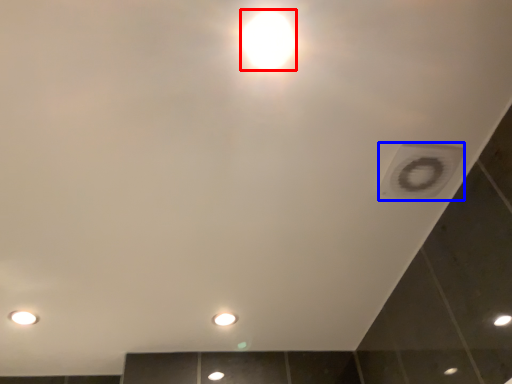
Question: Which point is closer to the camera, light bulb (highlighted by a red box) or hole (highlighted by a blue box)?

Choices:
 (A) light bulb
 (B) hole

Answer: (A)